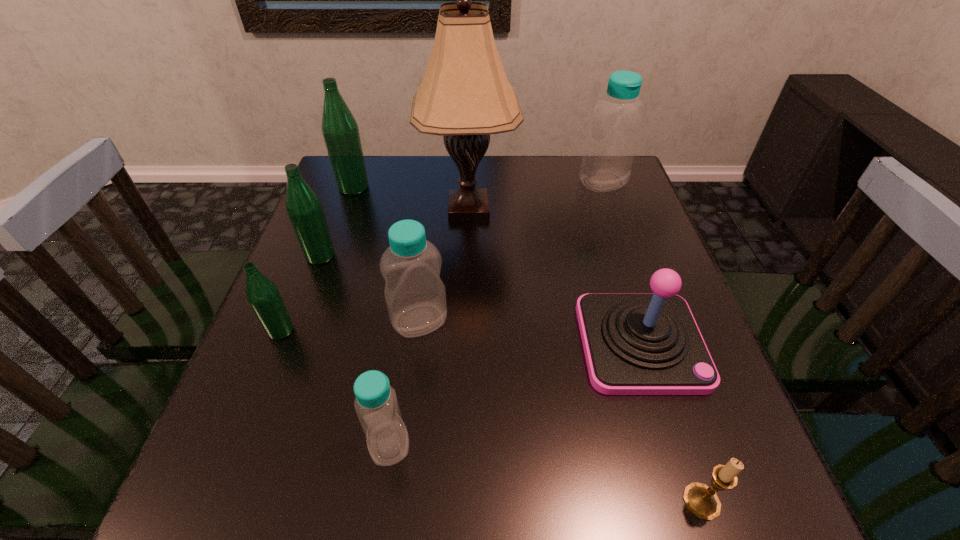
This screenshot has height=540, width=960. Find the location of `free space between the farthest blue bottle and the second biggest blue bottle`. free space between the farthest blue bottle and the second biggest blue bottle is located at coordinates (512, 251).

Identify the location of unoccupied position between the rightmost blue bottle and the joystick. Image resolution: width=960 pixels, height=540 pixels. (622, 262).

Locate an element on the screen. The image size is (960, 540). free area in between the fourth nearest bottle and the joystick is located at coordinates (481, 299).

This screenshot has height=540, width=960. Find the location of `free space that is in between the joystick and the farthest green bottle`. free space that is in between the joystick and the farthest green bottle is located at coordinates (497, 265).

Select which object appears as the second closest to the shortest object. Please provide its 2D coordinates. Your answer should be formatted as a tuple, i.e. [(x, y)], where the tuple contains the x and y coordinates of a point satisfying the conditions above.

[(376, 404)]

Find the location of a particular element. The image size is (960, 540). object that ranks as the fifth closest to the nearest green bottle is located at coordinates (340, 131).

What are the coordinates of `bottle identified as the fifth closest to the second farthest blue bottle` in the screenshot? It's located at (612, 140).

At what (x,y) coordinates should I click in order to perform the action: click on the closest bottle to the third farthest bottle. Please return your answer as a coordinate pair (x, y). Looking at the image, I should click on (262, 294).

Identify the location of the closest blue bottle relative to the second biggest blue bottle. The width and height of the screenshot is (960, 540). (376, 404).

Identify which blue bottle is the nearest to the nearest bottle. Please provide its 2D coordinates. Your answer should be formatted as a tuple, i.e. [(x, y)], where the tuple contains the x and y coordinates of a point satisfying the conditions above.

[(415, 295)]